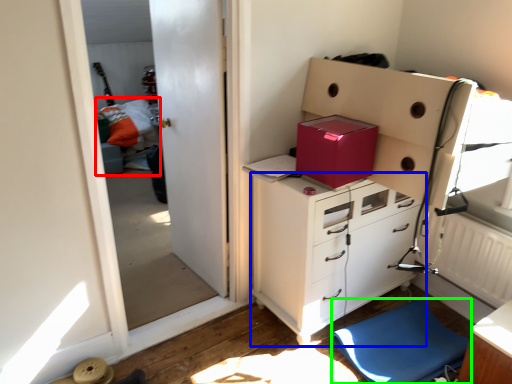
Question: Which is farther away from bed (highlighted by a red box)? chest of drawers (highlighted by a blue box) or furniture (highlighted by a green box)?

Choices:
 (A) chest of drawers
 (B) furniture

Answer: (B)